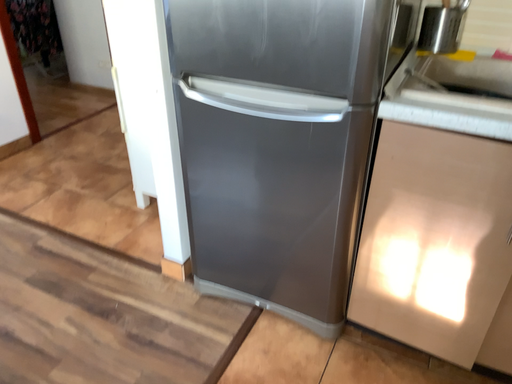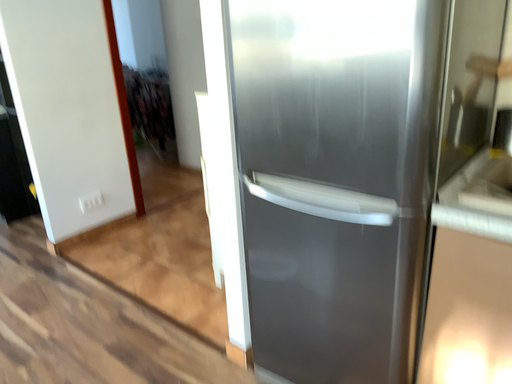
Question: Which way did the camera rotate in the video?

Choices:
 (A) rotated upward
 (B) rotated downward

Answer: (A)